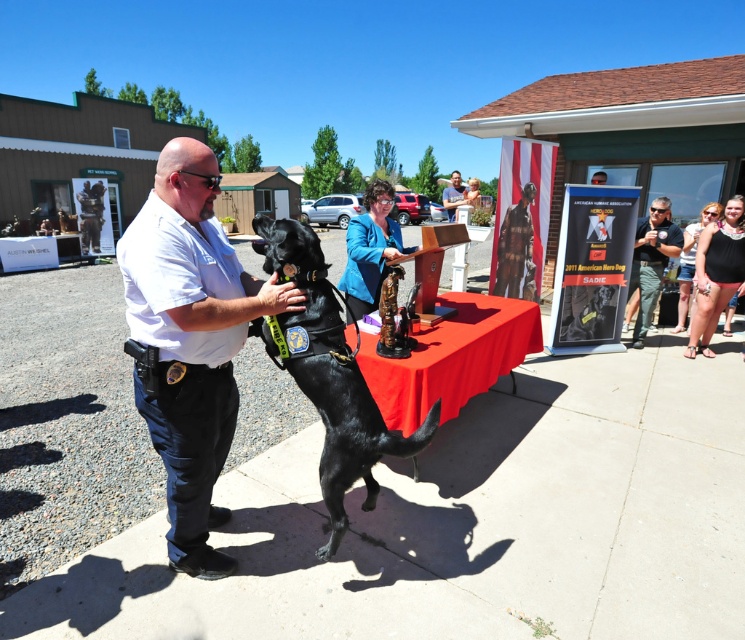
Question: Can you confirm if black matte dog at center is positioned to the left of dark blue uniform at right?

Choices:
 (A) yes
 (B) no

Answer: (A)

Question: Which of the following is the closest to the observer?

Choices:
 (A) (301, 301)
 (B) (294, 314)
 (C) (659, 216)

Answer: (A)

Question: Which of the following is the farthest from the observer?

Choices:
 (A) (453, 189)
 (B) (484, 388)

Answer: (A)

Question: Which point is closer to the camera?

Choices:
 (A) dark blue uniform at right
 (B) red cloth table at center
 (C) matte black uniform at center

Answer: (B)

Question: Is black matte dog at center bigger than matte black uniform at center?

Choices:
 (A) yes
 (B) no

Answer: (B)

Question: Does red cloth table at center lie in front of matte black uniform at center?

Choices:
 (A) no
 (B) yes

Answer: (B)